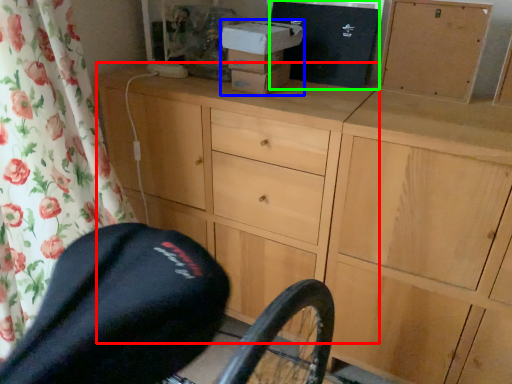
Question: Which is farther away from chest of drawers (highlighted by a red box)? box (highlighted by a blue box) or box (highlighted by a green box)?

Choices:
 (A) box
 (B) box

Answer: (B)